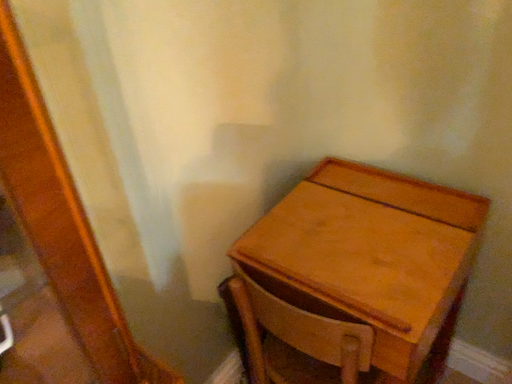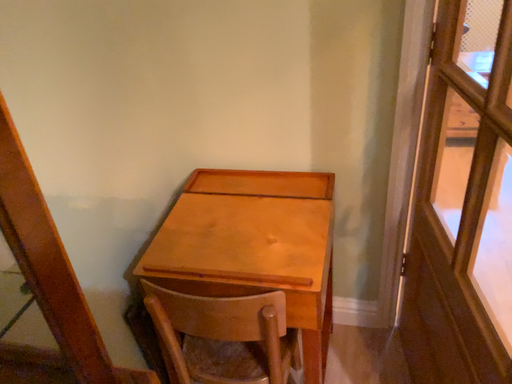
Question: Which way did the camera rotate in the video?

Choices:
 (A) rotated downward
 (B) rotated upward

Answer: (B)